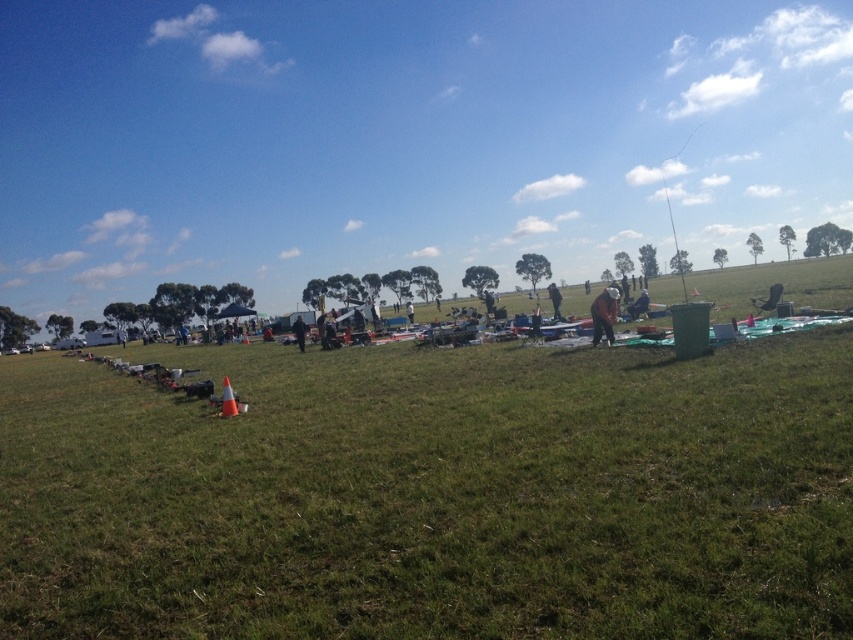
You are standing at the point marked as point (x=433, y=493) in the image. What type of terrain are you currently standing on?

The point (x=433, y=493) is on green grass at center, so you are standing on green grass.